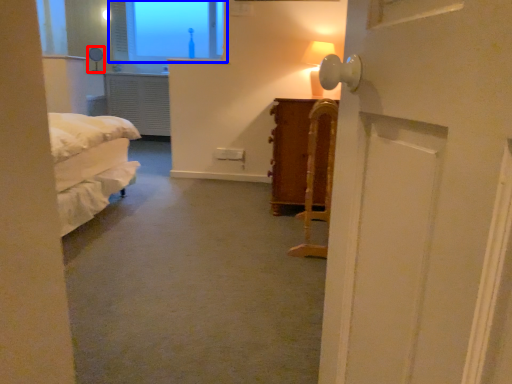
Question: Which of the following is the closest to the observer, table lamp (highlighted by a red box) or window (highlighted by a blue box)?

Choices:
 (A) table lamp
 (B) window

Answer: (A)